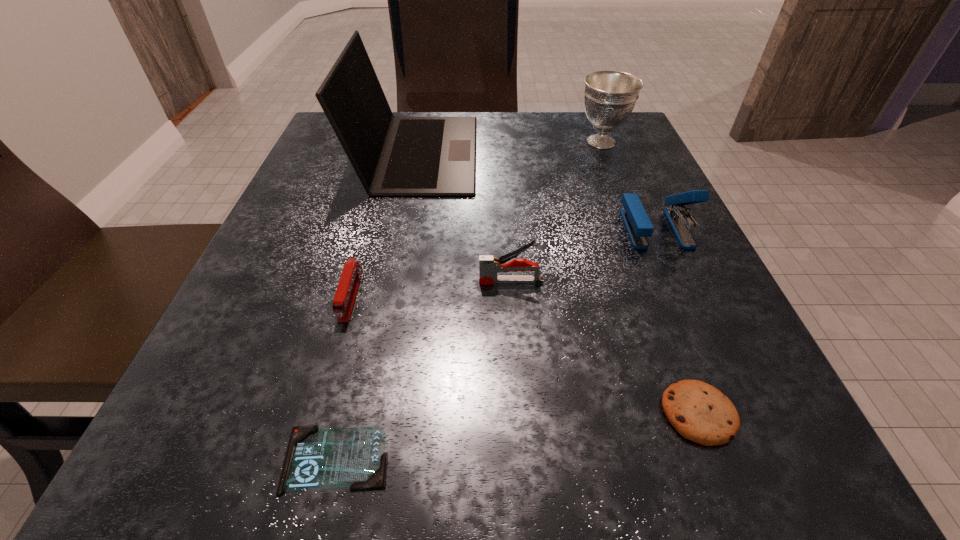
You are a GUI agent. You are given a task and a screenshot of the screen. Output one action in this format:
    pyautogui.click(x=<x>, y=<y>)
    Task: Click on the object located in the far right corner section of the desktop
    This screenshot has height=540, width=960.
    Given the screenshot: What is the action you would take?
    pyautogui.click(x=610, y=96)

Where is `object present at the near right corner`? object present at the near right corner is located at coordinates (699, 412).

Locate an element on the screen. The width and height of the screenshot is (960, 540). free space at the far edge is located at coordinates (484, 124).

The image size is (960, 540). What are the coordinates of `vacant space at the left edge of the desktop` in the screenshot? It's located at (354, 251).

This screenshot has width=960, height=540. In the image, there is a desktop. What are the coordinates of `free space at the right edge` in the screenshot? It's located at (596, 229).

You are a GUI agent. You are given a task and a screenshot of the screen. Output one action in this format:
    pyautogui.click(x=<x>, y=<y>)
    Task: Click on the vacant space at the near left corner of the desktop
    The height and width of the screenshot is (540, 960).
    Given the screenshot: What is the action you would take?
    pyautogui.click(x=170, y=474)

The width and height of the screenshot is (960, 540). Find the location of `free space at the near right corner`. free space at the near right corner is located at coordinates (759, 510).

Find the location of a particular element. The height and width of the screenshot is (540, 960). vacant space that is in between the second tallest object and the rightmost stapler is located at coordinates (629, 185).

Locate an element on the screen. vacant region between the second shortest object and the second tallest object is located at coordinates (650, 278).

Find the location of a particular element. This screenshot has width=960, height=540. free spot between the second stapler from right to left and the shortest object is located at coordinates (423, 370).